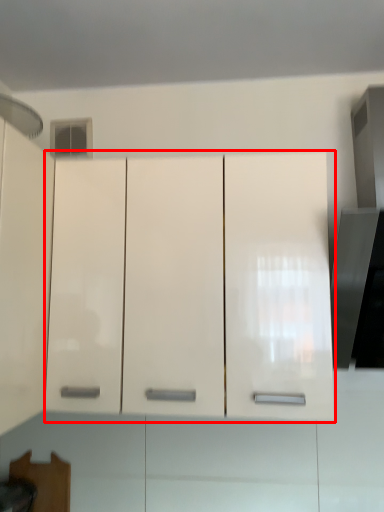
Question: From the image's perspective, where is cabinetry (annotated by the red box) located relative to exhaust hood?

Choices:
 (A) above
 (B) below

Answer: (B)